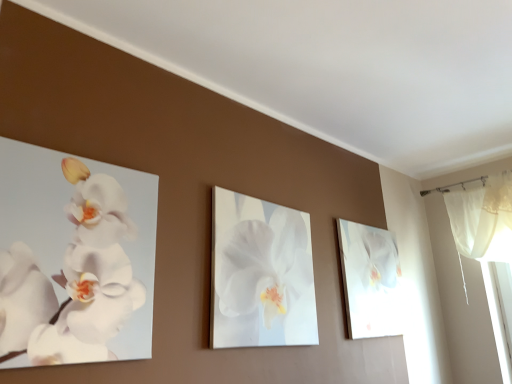
Measure the distance between point [92,294] and camera.

The distance of point [92,294] from camera is 3.79 feet.

What do you see at coordinates (370, 280) in the screenshot?
I see `white glossy orchid painting at right` at bounding box center [370, 280].

Where is `white glossy orchid at center, the first flower when ordered from back to front`? The height and width of the screenshot is (384, 512). white glossy orchid at center, the first flower when ordered from back to front is located at coordinates (265, 266).

Is point (10, 273) behind point (375, 334)?

No, it is in front of (375, 334).

Which object is more forward, white matte orchid at left, arranged as the second flower when viewed from the back, or white glossy orchid painting at right?

white matte orchid at left, arranged as the second flower when viewed from the back, is in front.

How different are the orientations of white matte orchid at left, marked as the 2th flower in a right-to-left arrangement, and white glossy orchid painting at right in degrees?

They differ by 0.000444 degrees in their facing directions.

Starting from the white glossy orchid painting at right, which flower is the 2nd one to the left? Please provide its 2D coordinates.

[(73, 279)]

Which object is closer to the camera, white matte orchid at left, arranged as the second flower when viewed from the back, or white glossy orchid at center, which is the first flower from right to left?

white matte orchid at left, arranged as the second flower when viewed from the back, is in front.

Looking at this image, from the image's perspective, is white matte orchid at left, marked as the 2th flower in a right-to-left arrangement, above or below white glossy orchid at center, which is the first flower from right to left?

white matte orchid at left, marked as the 2th flower in a right-to-left arrangement, is situated higher than white glossy orchid at center, which is the first flower from right to left, in the image.

Can you confirm if white matte orchid at left, which is the 1th flower from front to back, is shorter than white glossy orchid at center, the 2th flower positioned from the left?

Yes, white matte orchid at left, which is the 1th flower from front to back, is shorter than white glossy orchid at center, the 2th flower positioned from the left.

From a real-world perspective, which object rests below the other?

From a 3D spatial view, white matte orchid at left, which appears as the first flower when viewed from the left, is below.

From a real-world perspective, which is physically below, white glossy orchid painting at right or white glossy orchid at center, which is the first flower from right to left?

white glossy orchid at center, which is the first flower from right to left, from a real-world perspective.

At what (x,y) coordinates should I click in order to perform the action: click on flower that is the 1st one below the white glossy orchid painting at right (from a real-world perspective). Please return your answer as a coordinate pair (x, y). This screenshot has height=384, width=512. Looking at the image, I should click on (265, 266).

Between white glossy orchid painting at right and white glossy orchid at center, the 2th flower positioned from the left, which one has more height?

white glossy orchid at center, the 2th flower positioned from the left, is taller.

From the image's perspective, would you say white glossy orchid painting at right is shown under white glossy orchid at center, the 2th flower positioned from the front?

Indeed, from the image's perspective, white glossy orchid painting at right is shown beneath white glossy orchid at center, the 2th flower positioned from the front.

Consider the image. Between white glossy orchid at center, the first flower when ordered from back to front, and white glossy orchid painting at right, which one has less height?

With less height is white glossy orchid painting at right.

Image resolution: width=512 pixels, height=384 pixels. Identify the location of picture frame to the right of white glossy orchid at center, the first flower when ordered from back to front. (370, 280).

Is white glossy orchid at center, which is the first flower from right to left, looking in the opposite direction of white glossy orchid painting at right?

No, white glossy orchid at center, which is the first flower from right to left, is not facing the opposite direction of white glossy orchid painting at right.

From a real-world perspective, who is located lower, white glossy orchid at center, which is the first flower from right to left, or white matte orchid at left, which appears as the first flower when viewed from the left?

In real-world perspective, white matte orchid at left, which appears as the first flower when viewed from the left, is lower.

Can you confirm if white glossy orchid at center, the 2th flower positioned from the front, is thinner than white matte orchid at left, marked as the 2th flower in a right-to-left arrangement?

Correct, the width of white glossy orchid at center, the 2th flower positioned from the front, is less than that of white matte orchid at left, marked as the 2th flower in a right-to-left arrangement.

Is white glossy orchid at center, the first flower when ordered from back to front, turned away from white matte orchid at left, marked as the 2th flower in a right-to-left arrangement?

white glossy orchid at center, the first flower when ordered from back to front, is not turned away from white matte orchid at left, marked as the 2th flower in a right-to-left arrangement.

Is white glossy orchid at center, the first flower when ordered from back to front, located outside white matte orchid at left, arranged as the second flower when viewed from the back?

Yes, white glossy orchid at center, the first flower when ordered from back to front, is not within white matte orchid at left, arranged as the second flower when viewed from the back.

Is white glossy orchid painting at right positioned far away from white matte orchid at left, marked as the 2th flower in a right-to-left arrangement?

white glossy orchid painting at right is far away from white matte orchid at left, marked as the 2th flower in a right-to-left arrangement.

Does white glossy orchid painting at right have a lesser height compared to white matte orchid at left, arranged as the second flower when viewed from the back?

Incorrect, the height of white glossy orchid painting at right does not fall short of that of white matte orchid at left, arranged as the second flower when viewed from the back.

Considering the positions of objects white glossy orchid painting at right and white matte orchid at left, arranged as the second flower when viewed from the back, in the image provided, who is more to the right, white glossy orchid painting at right or white matte orchid at left, arranged as the second flower when viewed from the back,?

Positioned to the right is white glossy orchid painting at right.

Which flower is the 2nd one when counting from the front of the white glossy orchid painting at right? Please provide its 2D coordinates.

[(73, 279)]

I want to click on flower that is above the white glossy orchid at center, which is the first flower from right to left (from the image's perspective), so click(x=73, y=279).

Which object lies further to the anchor point white glossy orchid painting at right, white matte orchid at left, which is the 1th flower from front to back, or white glossy orchid at center, the 2th flower positioned from the front?

Among the two, white matte orchid at left, which is the 1th flower from front to back, is located further to white glossy orchid painting at right.

Estimate the real-world distances between objects in this image. Which object is closer to white glossy orchid at center, the 2th flower positioned from the left, white glossy orchid painting at right or white matte orchid at left, which appears as the first flower when viewed from the left?

Based on the image, white matte orchid at left, which appears as the first flower when viewed from the left, appears to be nearer to white glossy orchid at center, the 2th flower positioned from the left.

Considering their positions, is white glossy orchid painting at right positioned closer to white matte orchid at left, marked as the 2th flower in a right-to-left arrangement, than white glossy orchid at center, the first flower when ordered from back to front?

The object closer to white matte orchid at left, marked as the 2th flower in a right-to-left arrangement, is white glossy orchid at center, the first flower when ordered from back to front.

Looking at the image, which one is located closer to white glossy orchid painting at right, white glossy orchid at center, the 2th flower positioned from the front, or white matte orchid at left, which is the 1th flower from front to back?

Based on the image, white glossy orchid at center, the 2th flower positioned from the front, appears to be nearer to white glossy orchid painting at right.

Which object lies further to the anchor point white glossy orchid at center, the first flower when ordered from back to front, white matte orchid at left, which appears as the first flower when viewed from the left, or white glossy orchid painting at right?

The object further to white glossy orchid at center, the first flower when ordered from back to front, is white glossy orchid painting at right.

When comparing their distances from white matte orchid at left, marked as the 2th flower in a right-to-left arrangement, does white glossy orchid at center, the first flower when ordered from back to front, or white glossy orchid painting at right seem further?

white glossy orchid painting at right.

Where is `flower situated between white matte orchid at left, arranged as the second flower when viewed from the back, and white glossy orchid painting at right from left to right`? This screenshot has width=512, height=384. flower situated between white matte orchid at left, arranged as the second flower when viewed from the back, and white glossy orchid painting at right from left to right is located at coordinates (265, 266).